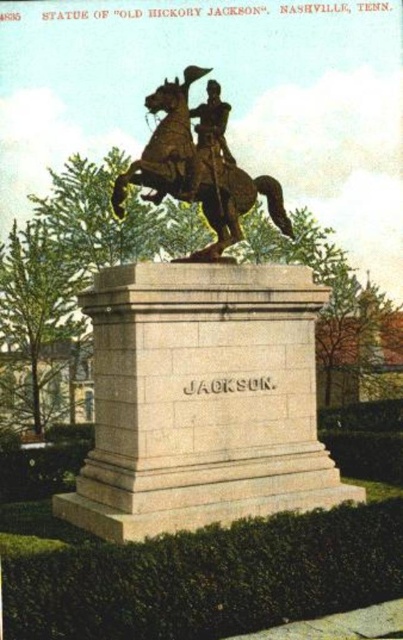
Question: Considering the relative positions of gold polished statue at center and gold polished metal horse at center in the image provided, where is gold polished statue at center located with respect to gold polished metal horse at center?

Choices:
 (A) left
 (B) right

Answer: (A)

Question: Can you confirm if gold polished statue at center is positioned below bronze statue at center?

Choices:
 (A) yes
 (B) no

Answer: (A)

Question: Which object is positioned closest to the bronze statue at center?

Choices:
 (A) gold polished statue at center
 (B) gold polished metal horse at center

Answer: (B)

Question: Does gold polished statue at center have a lesser width compared to bronze statue at center?

Choices:
 (A) yes
 (B) no

Answer: (B)

Question: Which point is closer to the camera taking this photo?

Choices:
 (A) (197, 112)
 (B) (214, 458)

Answer: (B)

Question: Based on their relative distances, which object is farther from the gold polished statue at center?

Choices:
 (A) gold polished metal horse at center
 (B) bronze statue at center

Answer: (B)